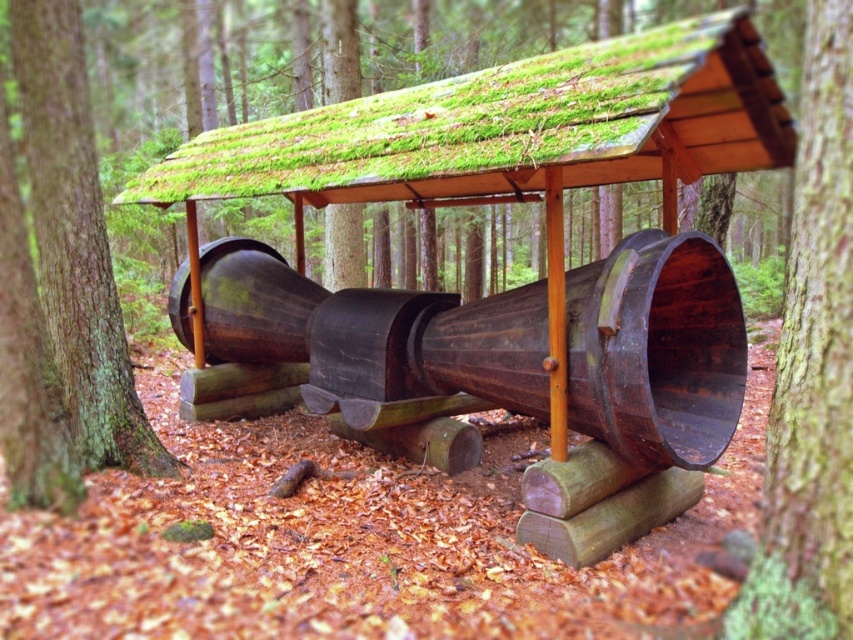
In the scene shown: You are standing at the entrance of the wooden structure in the forest. You need to locate the green mossy bark at center. Based on the coordinates provided, where would you find it?

The green mossy bark at center is located at coordinates point (811,369).

You are standing in the forest and want to take a photo of the green mossy roof at center and the brown wood tree trunk at left. Which object will appear larger in the photo?

The green mossy roof at center will appear larger in the photo because it is closer to you than the brown wood tree trunk at left.

You are standing in the forest and want to measure the distance to the green mossy roof at center. If your measuring tape can extend up to 3 meters, will it be sufficient to reach the roof?

The distance between you and the green mossy roof at center is 3.53 meters, which is longer than the 3 meter capacity of your measuring tape. Therefore, your measuring tape is not sufficient to reach the roof.